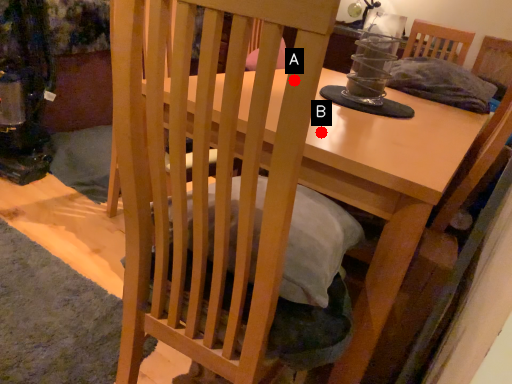
Question: Two points are circled on the image, labeled by A and B beside each circle. Among these points, which one is farthest from the camera?

Choices:
 (A) A is further
 (B) B is further

Answer: (B)